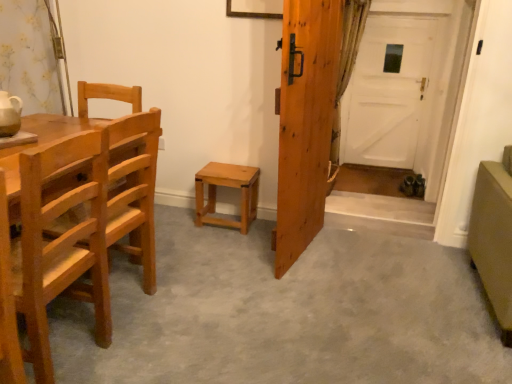
You are a GUI agent. You are given a task and a screenshot of the screen. Output one action in this format:
    pyautogui.click(x=<x>, y=<y>)
    Task: Click on the free space below light brown wood chair at left, the 1th chair in the front-to-back sequence (from a real-world perspective)
    
    Given the screenshot: What is the action you would take?
    pyautogui.click(x=75, y=353)